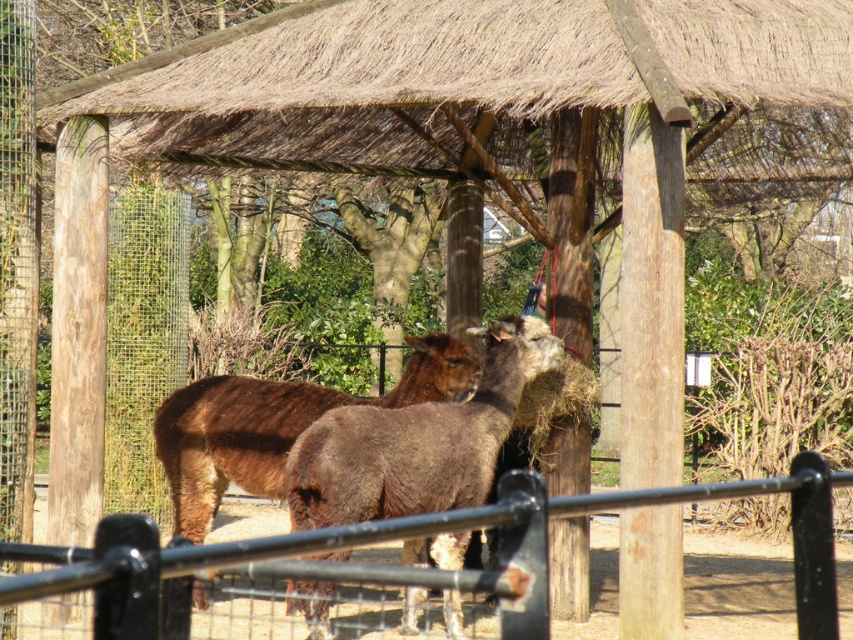
Question: Estimate the real-world distances between objects in this image. Which object is closer to the black metal fence at lower center?

Choices:
 (A) brown woolly alpaca at center
 (B) brown fuzzy alpaca at center

Answer: (B)

Question: Which point is closer to the camera?

Choices:
 (A) (200, 467)
 (B) (225, 564)

Answer: (B)

Question: Is black metal fence at lower center positioned before brown fuzzy alpaca at center?

Choices:
 (A) yes
 (B) no

Answer: (A)

Question: Which of these objects is positioned farthest from the brown woolly alpaca at center?

Choices:
 (A) black metal fence at lower center
 (B) brown fuzzy alpaca at center

Answer: (A)

Question: Does brown fuzzy alpaca at center lie in front of brown woolly alpaca at center?

Choices:
 (A) yes
 (B) no

Answer: (A)

Question: Can you confirm if brown fuzzy alpaca at center is positioned to the right of brown woolly alpaca at center?

Choices:
 (A) no
 (B) yes

Answer: (B)